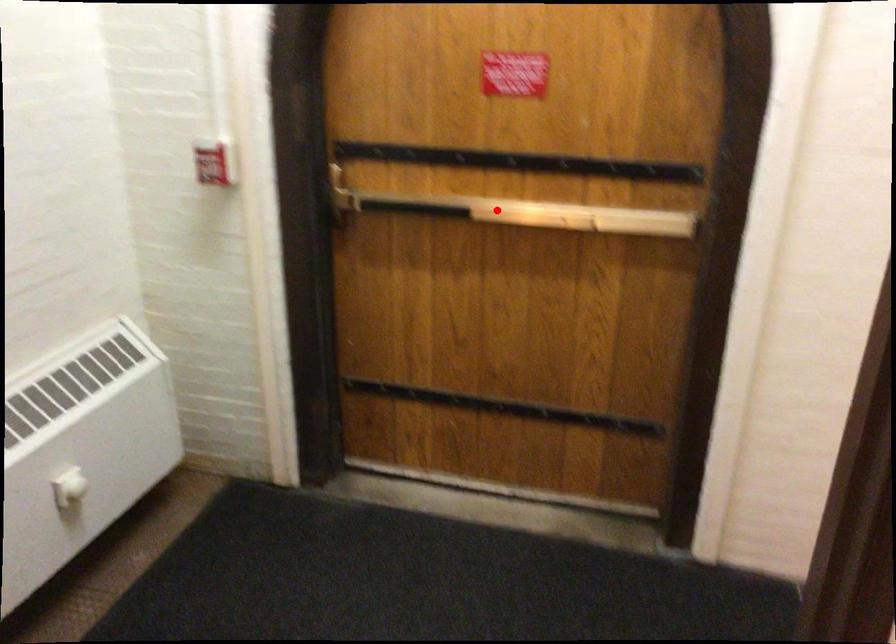
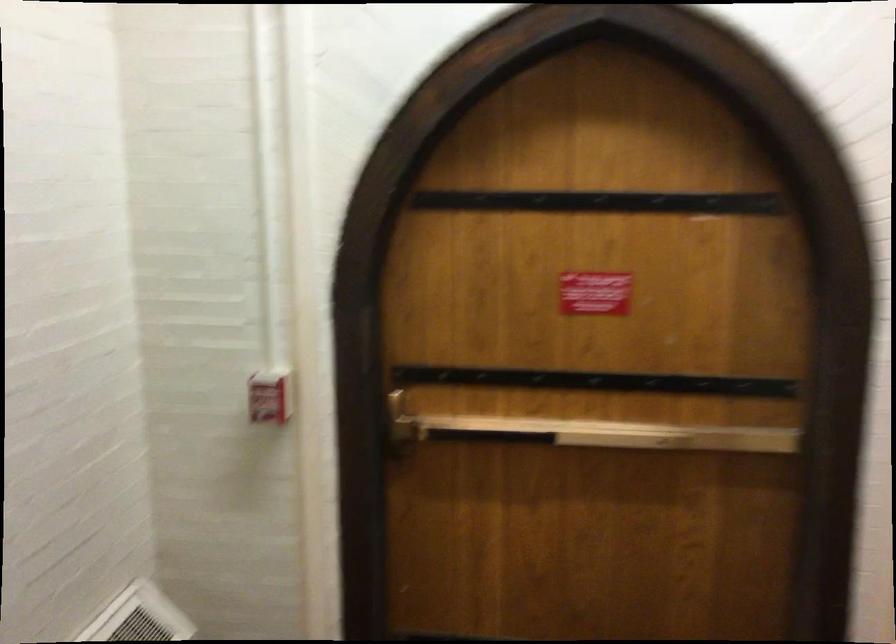
Question: I am providing you with two images of the same scene from different viewpoints. Given a red point in image1, look at the same physical point in image2. Is it:

Choices:
 (A) Closer to the viewpoint
 (B) Farther from the viewpoint

Answer: (A)